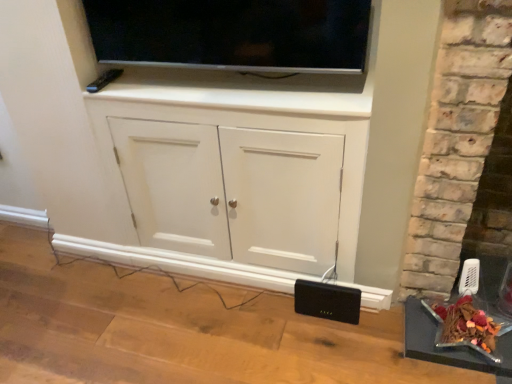
Question: Considering the relative positions of metallic silver tray at lower right and matte black tv at upper center in the image provided, is metallic silver tray at lower right to the right of matte black tv at upper center from the viewer's perspective?

Choices:
 (A) yes
 (B) no

Answer: (A)

Question: From the image's perspective, does metallic silver tray at lower right appear lower than matte black tv at upper center?

Choices:
 (A) no
 (B) yes

Answer: (B)

Question: Can you confirm if metallic silver tray at lower right is thinner than matte black tv at upper center?

Choices:
 (A) no
 (B) yes

Answer: (A)

Question: Considering the relative sizes of metallic silver tray at lower right and matte black tv at upper center in the image provided, is metallic silver tray at lower right smaller than matte black tv at upper center?

Choices:
 (A) yes
 (B) no

Answer: (A)

Question: Can you confirm if metallic silver tray at lower right is shorter than matte black tv at upper center?

Choices:
 (A) yes
 (B) no

Answer: (A)

Question: Could you tell me if metallic silver tray at lower right is turned towards matte black tv at upper center?

Choices:
 (A) no
 (B) yes

Answer: (A)

Question: Is black plastic speaker at lower right to the left of metallic silver tray at lower right from the viewer's perspective?

Choices:
 (A) yes
 (B) no

Answer: (A)

Question: From a real-world perspective, is black plastic speaker at lower right on top of metallic silver tray at lower right?

Choices:
 (A) yes
 (B) no

Answer: (B)

Question: Is black plastic speaker at lower right looking in the opposite direction of metallic silver tray at lower right?

Choices:
 (A) yes
 (B) no

Answer: (B)

Question: Are black plastic speaker at lower right and metallic silver tray at lower right located far from each other?

Choices:
 (A) no
 (B) yes

Answer: (A)

Question: Does black plastic speaker at lower right have a lesser width compared to metallic silver tray at lower right?

Choices:
 (A) yes
 (B) no

Answer: (A)

Question: Is black plastic speaker at lower right taller than metallic silver tray at lower right?

Choices:
 (A) yes
 (B) no

Answer: (A)

Question: Does metallic silver tray at lower right have a greater height compared to white matte cabinet at center?

Choices:
 (A) yes
 (B) no

Answer: (B)